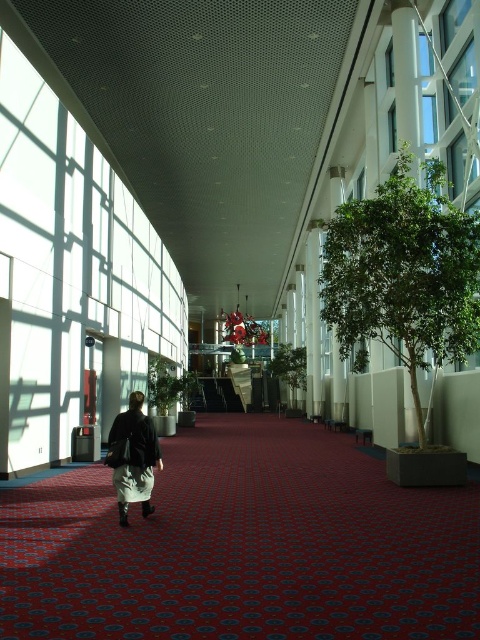
You are standing at the entrance of the corridor and want to place a new potted plant exactly at the center of the corridor. Given the current layout, will the green leafy tree at right interfere with this placement?

The green leafy tree at right is located at point (404,273), which is not at the center of the corridor. Therefore, placing a new potted plant at the center will not interfere with the green leafy tree at right.

You are standing at the entrance of the corridor and want to walk to the point marked as point (x=285, y=364). However, there is an obstacle at point (x=137, y=490). Can you safely walk around the obstacle to reach your destination?

Point (x=137, y=490) is in front of point (x=285, y=364), so the obstacle is blocking the direct path. You will need to detour around it to reach your destination safely.

You are a delivery person carrying a long package that is 1.2 meters wide. You need to walk through the corridor shown in the image. Can you pass between the green leafy tree at right and the dark brown leather jacket at center without tilting the package?

The green leafy tree at right is thinner than the dark brown leather jacket at center. The space between them is determined by the width of the tree and jacket. Since the package is 1.2 meters wide, but the exact distance between the objects isn